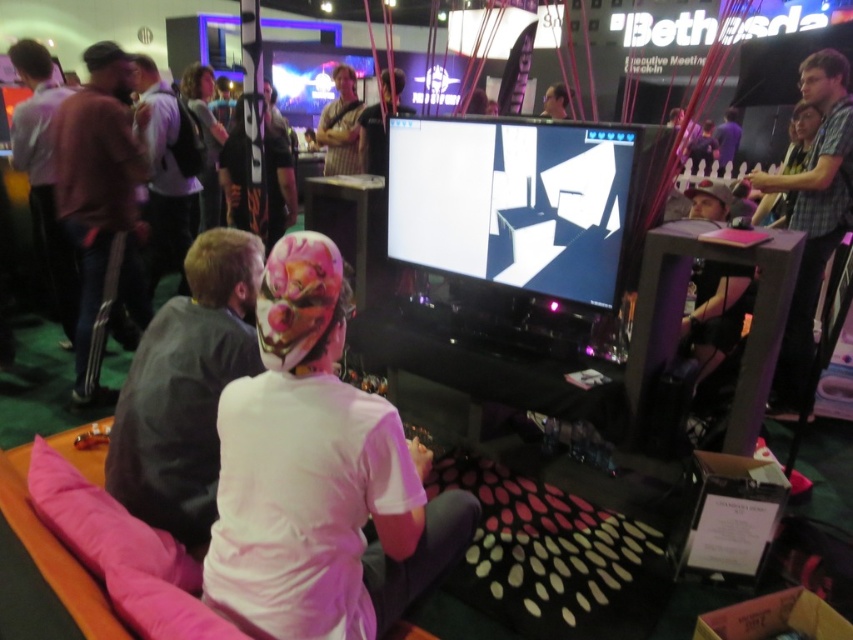
You are a game developer attending the Bethesda booth and notice a person sitting on the couch with pink cushions. You want to hand them a promotional item. The couch is at point [318,476]. Where exactly should you approach them from?

The white matte shirt at center is located at point [318,476], so you should approach them from the front to ensure they can see you while they are playing the game.

You are at the Bethesda booth and need to place a small promotional item on the brown leather jacket at left. According to the layout, where should you place it?

The brown leather jacket at left is located at coordinates point (102, 205), so place the promotional item there.